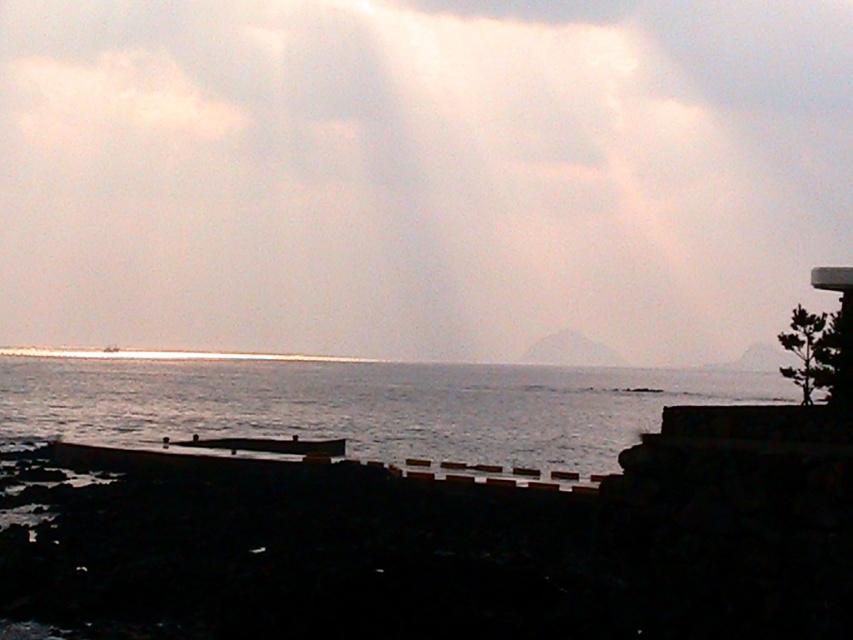
Question: Which object is farther from the camera taking this photo?

Choices:
 (A) white matte cloud at upper center
 (B) silvery water at lower left

Answer: (A)

Question: Considering the relative positions of white matte cloud at upper center and silvery water at lower left in the image provided, where is white matte cloud at upper center located with respect to silvery water at lower left?

Choices:
 (A) below
 (B) above

Answer: (B)

Question: Does white matte cloud at upper center have a greater width compared to silvery water at lower left?

Choices:
 (A) yes
 (B) no

Answer: (A)

Question: Does white matte cloud at upper center appear on the left side of silvery water at lower left?

Choices:
 (A) no
 (B) yes

Answer: (A)

Question: Among these objects, which one is nearest to the camera?

Choices:
 (A) silvery water at lower left
 (B) white matte cloud at upper center

Answer: (A)